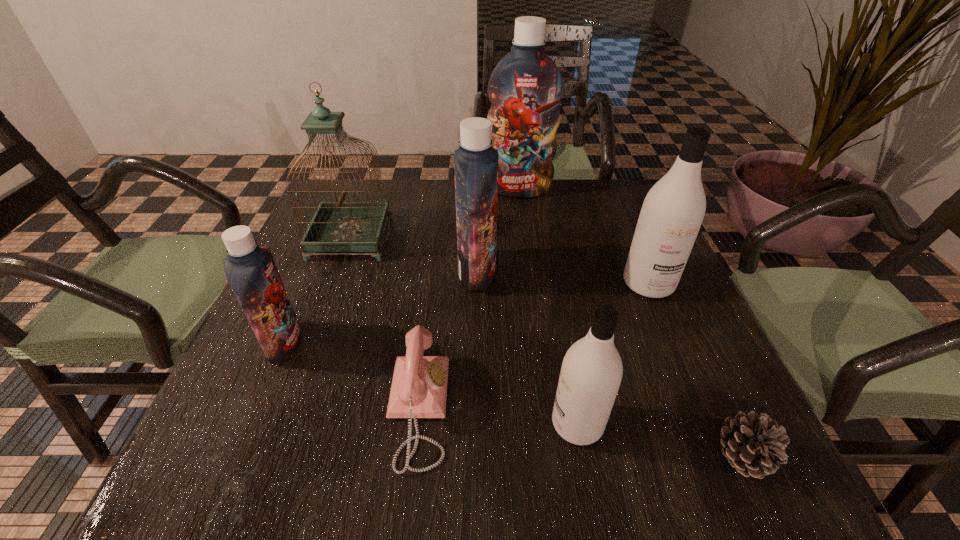
Identify the location of vacant region that satisfies the following two spatial constraints: 1. on the front label of the farthest shampoo; 2. on the dial of the sixth object from right to left. (546, 409).

The height and width of the screenshot is (540, 960). Find the location of `vacant space that satisfies the following two spatial constraints: 1. on the front-facing side of the rightmost shampoo; 2. on the right side of the shortest object`. vacant space that satisfies the following two spatial constraints: 1. on the front-facing side of the rightmost shampoo; 2. on the right side of the shortest object is located at coordinates (720, 456).

The width and height of the screenshot is (960, 540). I want to click on vacant area that satisfies the following two spatial constraints: 1. on the front-facing side of the bigger white shampoo; 2. on the front-facing side of the left white shampoo, so click(707, 423).